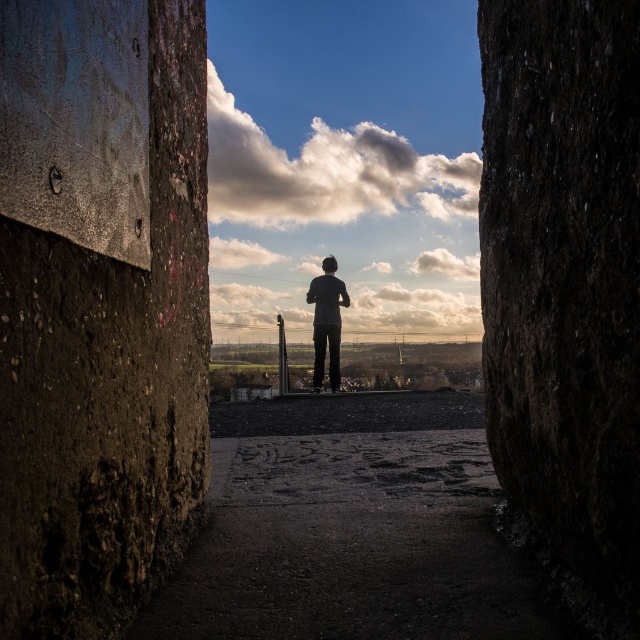
You are a construction worker who needs to place a 8.5 meter long steel beam between the rusty concrete wall at center and the dark gray fabric at center. Can you fit the beam between them without bending it?

The distance between the rusty concrete wall at center and the dark gray fabric at center is 7.95 meters. Since the beam is 8.5 meters long, it cannot be placed without bending it because the space is shorter than the beam.

You are a painter standing in front of the rusty concrete wall at center and the smooth concrete pole at center. You want to paint the object that is on the left side. Which object should you paint?

The smooth concrete pole at center is on the left side of the rusty concrete wall at center, so you should paint the smooth concrete pole at center.

You are a painter who wants to sketch the scene through the opening. Which object, the rusty concrete wall at center or the dark gray fabric at center, would you need to draw first based on their sizes?

The rusty concrete wall at center has a smaller size compared to the dark gray fabric at center, so you should draw the rusty concrete wall at center first as it is smaller and likely closer to the foreground.